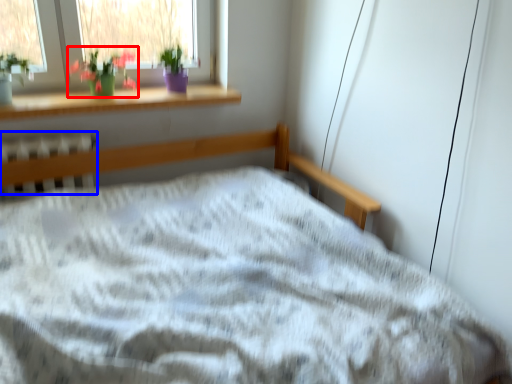
Question: Which object is closer to the camera taking this photo, floral arrangement (highlighted by a red box) or radiator (highlighted by a blue box)?

Choices:
 (A) floral arrangement
 (B) radiator

Answer: (B)